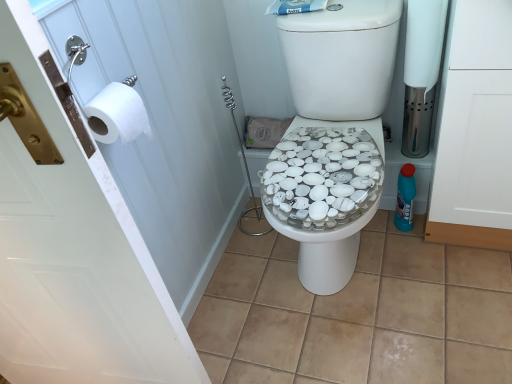
Question: From the image's perspective, is white paper at left, which appears as the second screen door when viewed from the right, located above or below blue plastic bottle at right?

Choices:
 (A) below
 (B) above

Answer: (B)

Question: In terms of size, does white paper at left, marked as the first screen door in a left-to-right arrangement, appear bigger or smaller than blue plastic bottle at right?

Choices:
 (A) big
 (B) small

Answer: (A)

Question: Which is nearer to the beige tile at center?

Choices:
 (A) white matte toilet paper at left, the second toilet paper in the top-to-bottom sequence
 (B) blue plastic bottle at right
 (C) white matte cabinet at right, which appears as the 1th screen door when viewed from the right
 (D) white paper at left, which appears as the second screen door when viewed from the right
 (E) white matte toilet paper at right, acting as the 1th toilet paper starting from the top

Answer: (B)

Question: Based on their relative distances, which object is nearer to the beige tile at center?

Choices:
 (A) white paper at left, marked as the first screen door in a left-to-right arrangement
 (B) blue plastic bottle at right
 (C) white matte toilet paper at right, placed as the 2th toilet paper when sorted from front to back
 (D) white matte cabinet at right, marked as the 2th screen door in a left-to-right arrangement
 (E) white matte toilet paper at left, the first toilet paper when ordered from front to back

Answer: (B)